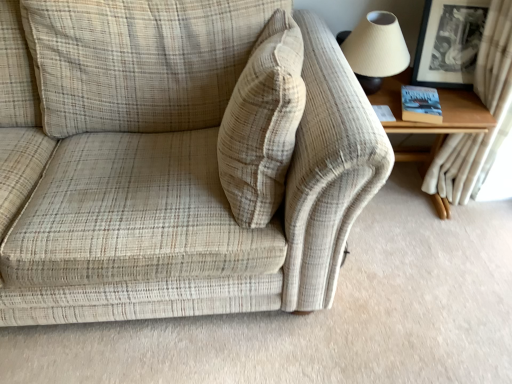
The height and width of the screenshot is (384, 512). What do you see at coordinates (432, 124) in the screenshot?
I see `wooden table at right` at bounding box center [432, 124].

Where is `white textured curtain at upper right`? This screenshot has height=384, width=512. white textured curtain at upper right is located at coordinates (489, 110).

This screenshot has height=384, width=512. What do you see at coordinates (449, 43) in the screenshot? I see `black glossy picture frame at upper right` at bounding box center [449, 43].

Measure the distance between beige plaid fabric couch at center and camera.

39.05 inches.

Locate an element on the screen. Image resolution: width=512 pixels, height=384 pixels. wooden table at right is located at coordinates (432, 124).

In terms of width, does white textured curtain at upper right look wider or thinner when compared to wooden table at right?

In the image, white textured curtain at upper right appears to be more narrow than wooden table at right.

Consider the image. Could you tell me if white textured curtain at upper right is facing wooden table at right?

Yes.

Consider the image. Is white textured curtain at upper right shorter than wooden table at right?

No.

What's the angular difference between white textured curtain at upper right and wooden table at right's facing directions?

white textured curtain at upper right and wooden table at right are facing 86.3 degrees away from each other.

Between white textured curtain at upper right and matte beige lampshade at upper right, which one has larger size?

Bigger between the two is white textured curtain at upper right.

Is white textured curtain at upper right at the left side of matte beige lampshade at upper right?

No, white textured curtain at upper right is not to the left of matte beige lampshade at upper right.

From a real-world perspective, is white textured curtain at upper right under matte beige lampshade at upper right?

Yes, from a real-world perspective, white textured curtain at upper right is beneath matte beige lampshade at upper right.

Looking at this image, are white textured curtain at upper right and matte beige lampshade at upper right beside each other?

No, white textured curtain at upper right is not touching matte beige lampshade at upper right.

Is black glossy picture frame at upper right positioned behind matte beige lampshade at upper right?

Yes.

From the image's perspective, who appears lower, black glossy picture frame at upper right or matte beige lampshade at upper right?

matte beige lampshade at upper right, from the image's perspective.

Is black glossy picture frame at upper right at the left side of matte beige lampshade at upper right?

No.

This screenshot has height=384, width=512. Find the location of `table lamp below the black glossy picture frame at upper right (from the image's perspective)`. table lamp below the black glossy picture frame at upper right (from the image's perspective) is located at coordinates (375, 49).

Can you confirm if beige plaid fabric couch at center is thinner than wooden table at right?

In fact, beige plaid fabric couch at center might be wider than wooden table at right.

From the image's perspective, which one is positioned higher, beige plaid fabric couch at center or wooden table at right?

wooden table at right appears higher in the image.

From a real-world perspective, who is located higher, beige plaid fabric couch at center or wooden table at right?

beige plaid fabric couch at center.

Choose the correct answer: Is beige plaid fabric couch at center inside wooden table at right or outside it?

beige plaid fabric couch at center is spatially situated outside wooden table at right.

Considering the positions of objects white textured curtain at upper right and beige corduroy pillow at center in the image provided, who is in front, white textured curtain at upper right or beige corduroy pillow at center?

beige corduroy pillow at center is in front.

Does point (490, 9) come closer to viewer compared to point (266, 152)?

No, (490, 9) is further to viewer.

From a real-world perspective, does white textured curtain at upper right sit lower than beige corduroy pillow at center?

Indeed, from a real-world perspective, white textured curtain at upper right is positioned beneath beige corduroy pillow at center.

Can you confirm if beige plaid fabric couch at center is smaller than beige corduroy pillow at center?

Incorrect, beige plaid fabric couch at center is not smaller in size than beige corduroy pillow at center.

Between beige plaid fabric couch at center and beige corduroy pillow at center, which one has less height?

With less height is beige corduroy pillow at center.

Identify the location of throw pillow above the beige plaid fabric couch at center (from a real-world perspective). The image size is (512, 384). (262, 123).

From a real-world perspective, is beige plaid fabric couch at center under beige corduroy pillow at center?

Yes.

Is white textured curtain at upper right smaller than black glossy picture frame at upper right?

Actually, white textured curtain at upper right might be larger than black glossy picture frame at upper right.

Is there a large distance between white textured curtain at upper right and black glossy picture frame at upper right?

white textured curtain at upper right is actually quite close to black glossy picture frame at upper right.

Is white textured curtain at upper right positioned beyond the bounds of black glossy picture frame at upper right?

Yes, white textured curtain at upper right is located beyond the bounds of black glossy picture frame at upper right.

The width and height of the screenshot is (512, 384). I want to click on curtain lying above the wooden table at right (from the image's perspective), so click(x=489, y=110).

Where is `table lamp lying on the left of white textured curtain at upper right`? The height and width of the screenshot is (384, 512). table lamp lying on the left of white textured curtain at upper right is located at coordinates (375, 49).

Estimate the real-world distances between objects in this image. Which object is further from matte beige lampshade at upper right, beige plaid fabric couch at center or beige corduroy pillow at center?

Based on the image, beige plaid fabric couch at center appears to be further to matte beige lampshade at upper right.

Based on their spatial positions, is matte beige lampshade at upper right or black glossy picture frame at upper right further from wooden table at right?

matte beige lampshade at upper right is further to wooden table at right.

From the image, which object appears to be nearer to wooden table at right, black glossy picture frame at upper right or beige corduroy pillow at center?

The object closer to wooden table at right is black glossy picture frame at upper right.

From the image, which object appears to be nearer to white textured curtain at upper right, matte beige lampshade at upper right or black glossy picture frame at upper right?

black glossy picture frame at upper right is positioned closer to the anchor white textured curtain at upper right.

From the image, which object appears to be farther from beige corduroy pillow at center, wooden table at right or black glossy picture frame at upper right?

black glossy picture frame at upper right lies further to beige corduroy pillow at center than the other object.

Which object lies nearer to the anchor point beige plaid fabric couch at center, beige corduroy pillow at center or black glossy picture frame at upper right?

beige corduroy pillow at center is closer to beige plaid fabric couch at center.

Estimate the real-world distances between objects in this image. Which object is further from beige corduroy pillow at center, beige plaid fabric couch at center or black glossy picture frame at upper right?

The object further to beige corduroy pillow at center is black glossy picture frame at upper right.

Considering their positions, is white textured curtain at upper right positioned closer to matte beige lampshade at upper right than wooden table at right?

Among the two, wooden table at right is located nearer to matte beige lampshade at upper right.

Locate an element on the screen. This screenshot has height=384, width=512. table lamp between beige corduroy pillow at center and wooden table at right in the horizontal direction is located at coordinates (375, 49).

At what (x,y) coordinates should I click in order to perform the action: click on table lamp between beige plaid fabric couch at center and wooden table at right in the horizontal direction. Please return your answer as a coordinate pair (x, y). Looking at the image, I should click on (375, 49).

Locate an element on the screen. table lamp situated between beige corduroy pillow at center and white textured curtain at upper right from left to right is located at coordinates (375, 49).

The height and width of the screenshot is (384, 512). Find the location of `table lamp that lies between black glossy picture frame at upper right and wooden table at right from top to bottom`. table lamp that lies between black glossy picture frame at upper right and wooden table at right from top to bottom is located at coordinates (375, 49).